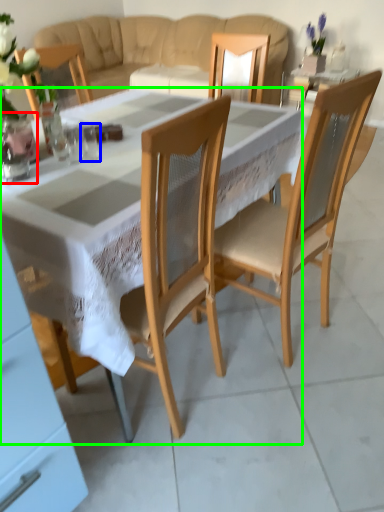
Question: Which object is positioned closest to vase (highlighted by a red box)? Select from tableware (highlighted by a blue box) and desk (highlighted by a green box).

Choices:
 (A) tableware
 (B) desk

Answer: (A)